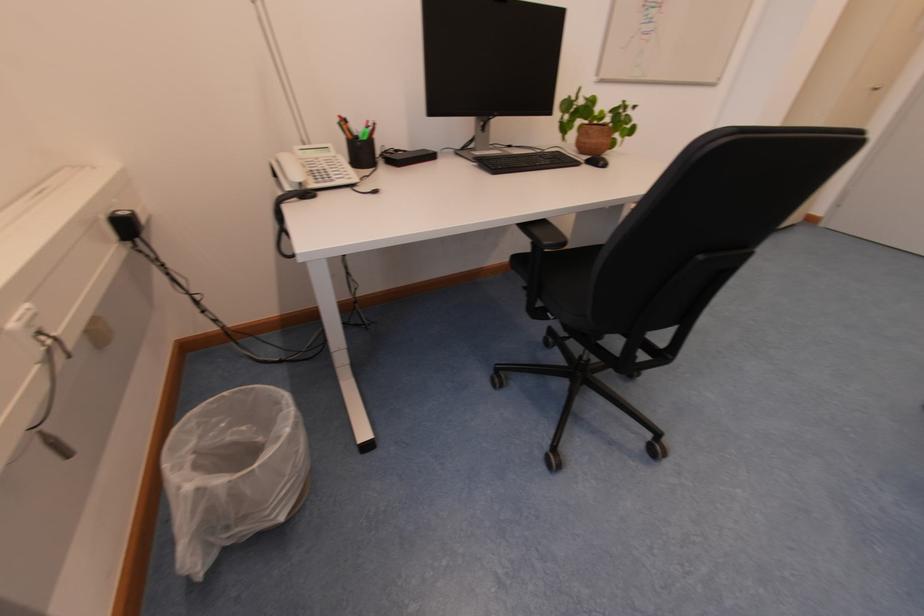
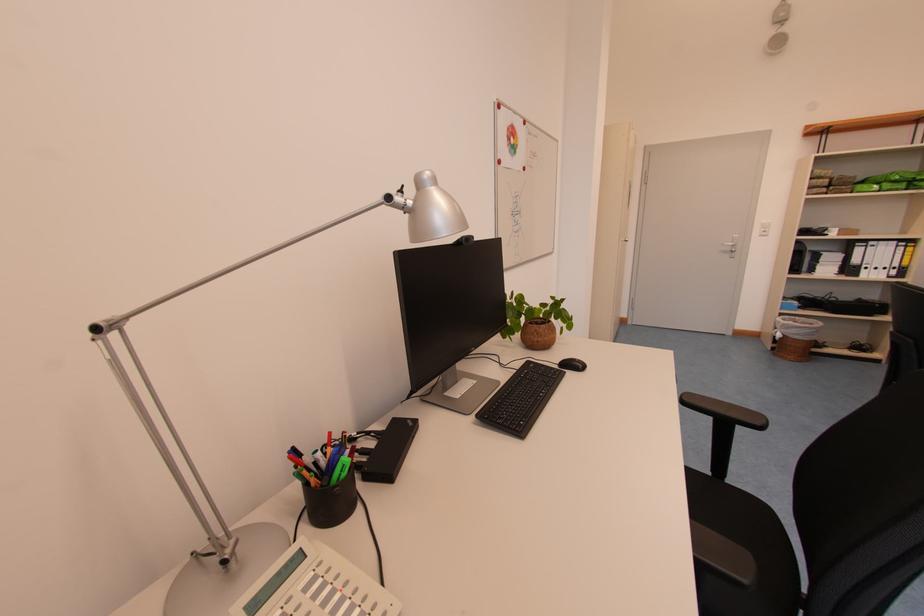
Where in the second image is the point corresponding to (x=590, y=164) from the first image?

(564, 369)